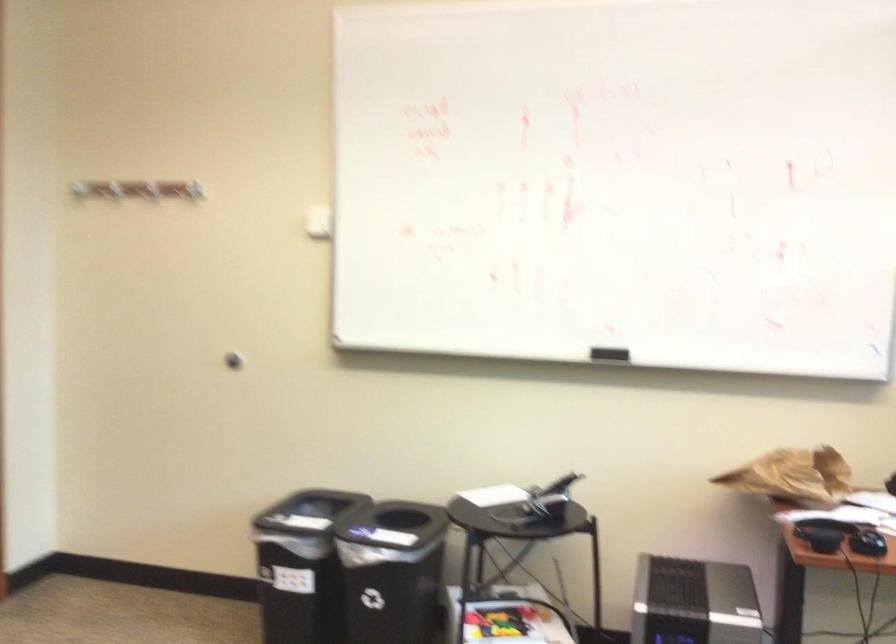
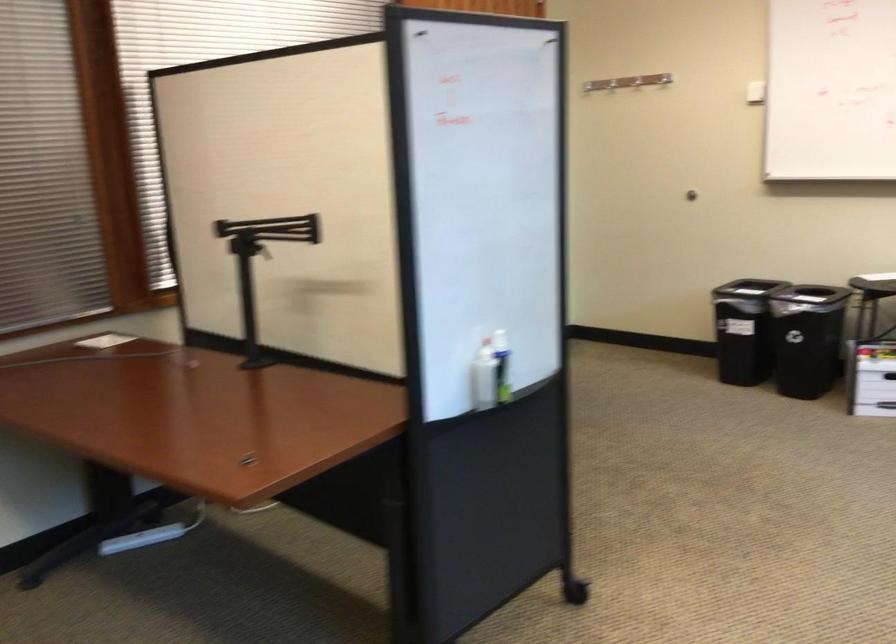
In the second image, find the point that corresponds to point 266,202 in the first image.

(636, 82)